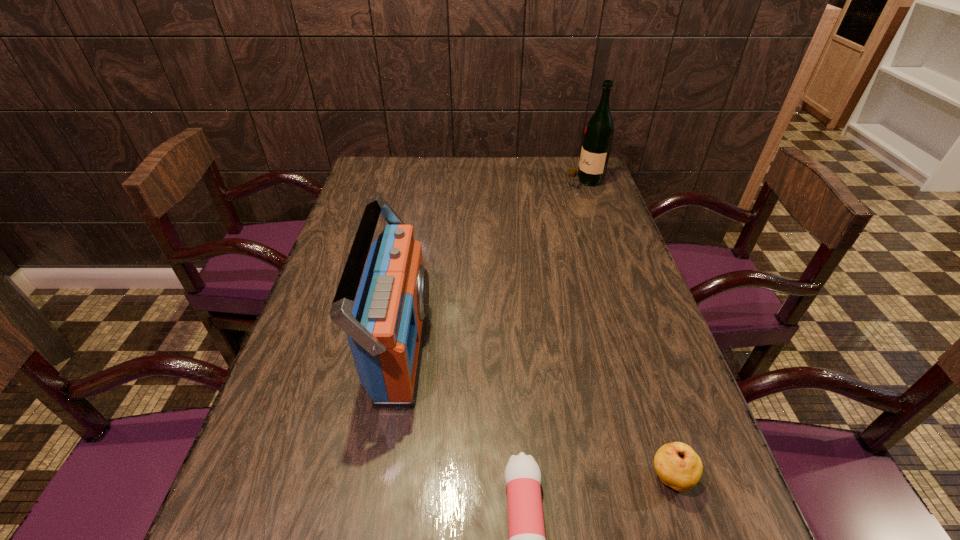
What are the coordinates of `the farthest object` in the screenshot? It's located at (598, 135).

Locate an element on the screen. the third nearest object is located at coordinates (385, 329).

Find the location of a particular element. The width and height of the screenshot is (960, 540). the leftmost object is located at coordinates (385, 329).

The image size is (960, 540). In order to click on the second shortest object in this screenshot , I will do `click(678, 466)`.

You are a GUI agent. You are given a task and a screenshot of the screen. Output one action in this format:
    pyautogui.click(x=<x>, y=<y>)
    Task: Click on the vacant space located on the surface of the farthest object
    
    Given the screenshot: What is the action you would take?
    pyautogui.click(x=532, y=181)

This screenshot has width=960, height=540. Find the location of `blank space located on the surface of the farthest object`. blank space located on the surface of the farthest object is located at coordinates (484, 181).

You are a GUI agent. You are given a task and a screenshot of the screen. Output one action in this format:
    pyautogui.click(x=<x>, y=<y>)
    Task: Click on the vacant region located on the surface of the farthest object
    The width and height of the screenshot is (960, 540).
    Given the screenshot: What is the action you would take?
    pyautogui.click(x=523, y=181)

This screenshot has height=540, width=960. What are the coordinates of `free region located on the front-facing side of the third nearest object` in the screenshot? It's located at (559, 346).

Image resolution: width=960 pixels, height=540 pixels. Find the location of `vacant region located 0.130m on the left of the third tallest object`. vacant region located 0.130m on the left of the third tallest object is located at coordinates (576, 478).

Locate an element on the screen. Image resolution: width=960 pixels, height=540 pixels. object located at the far edge is located at coordinates (598, 135).